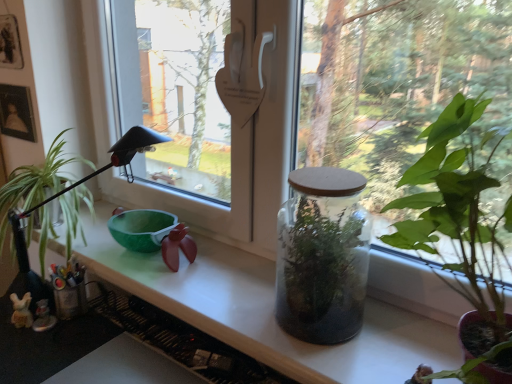
In order to click on vacant space situated above transparent glass jar at center (from a real-world perspective) in this screenshot , I will do `click(330, 184)`.